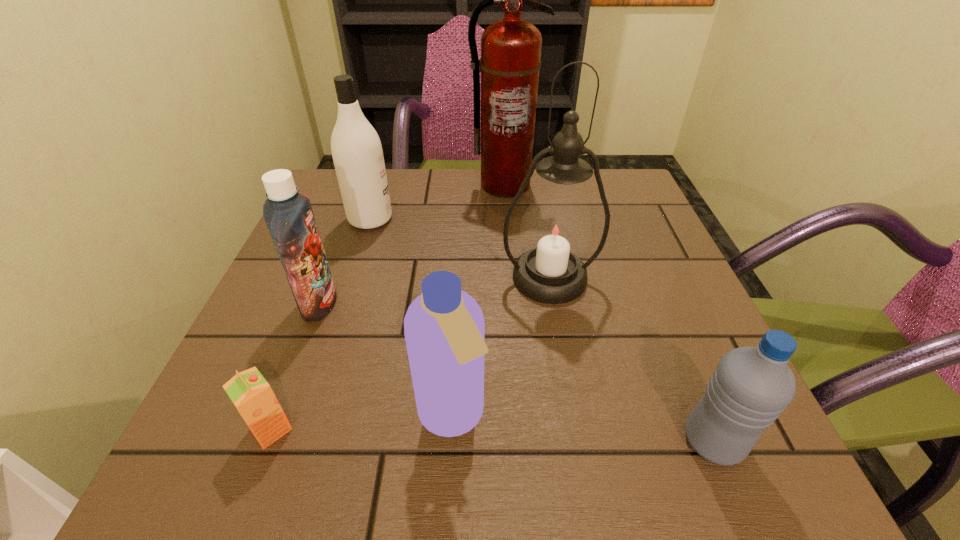
Point out which shampoo is positioned as the third nearest to the oil lamp. Please provide its 2D coordinates. Your answer should be formatted as a tuple, i.e. [(x, y)], where the tuple contains the x and y coordinates of a point satisfying the conditions above.

[(289, 216)]

Identify which shampoo is the third nearest to the orange juice. Please provide its 2D coordinates. Your answer should be formatted as a tuple, i.e. [(x, y)], where the tuple contains the x and y coordinates of a point satisfying the conditions above.

[(357, 152)]

Locate an element on the screen. The image size is (960, 540). free location that satisfies the following two spatial constraints: 1. on the front-facing side of the third tallest object; 2. on the back side of the oil lamp is located at coordinates (351, 278).

Identify the location of vacant region that satisfies the following two spatial constraints: 1. on the front label of the second nearest shampoo; 2. on the right side of the rightmost object. (267, 441).

Image resolution: width=960 pixels, height=540 pixels. Identify the location of free space in the image that satisfies the following two spatial constraints: 1. on the nozzle side of the oil lamp; 2. on the right side of the farthest object. (512, 278).

Where is `blank space that satisfies the following two spatial constraints: 1. on the front label of the second nearest shampoo; 2. on the back side of the orange juice`? The height and width of the screenshot is (540, 960). blank space that satisfies the following two spatial constraints: 1. on the front label of the second nearest shampoo; 2. on the back side of the orange juice is located at coordinates (271, 429).

Identify the location of free space in the image that satisfies the following two spatial constraints: 1. on the front label of the second nearest shampoo; 2. on the back side of the shortest object. This screenshot has height=540, width=960. (271, 429).

Where is `free region that satisfies the following two spatial constraints: 1. on the front-facing side of the sixth nearest object; 2. on the left side of the water bottle`? free region that satisfies the following two spatial constraints: 1. on the front-facing side of the sixth nearest object; 2. on the left side of the water bottle is located at coordinates (299, 441).

Locate an element on the screen. The image size is (960, 540). free region that satisfies the following two spatial constraints: 1. on the front-facing side of the third tallest object; 2. on the back side of the oil lamp is located at coordinates (351, 278).

Where is `free location that satisfies the following two spatial constraints: 1. on the front label of the second farthest shampoo; 2. on the back side of the rightmost object`? Image resolution: width=960 pixels, height=540 pixels. free location that satisfies the following two spatial constraints: 1. on the front label of the second farthest shampoo; 2. on the back side of the rightmost object is located at coordinates (267, 441).